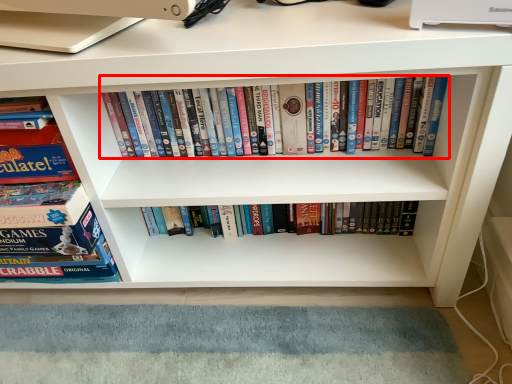
Question: From the image, what is the correct spatial relationship of book (annotated by the red box) in relation to book?

Choices:
 (A) left
 (B) right

Answer: (B)